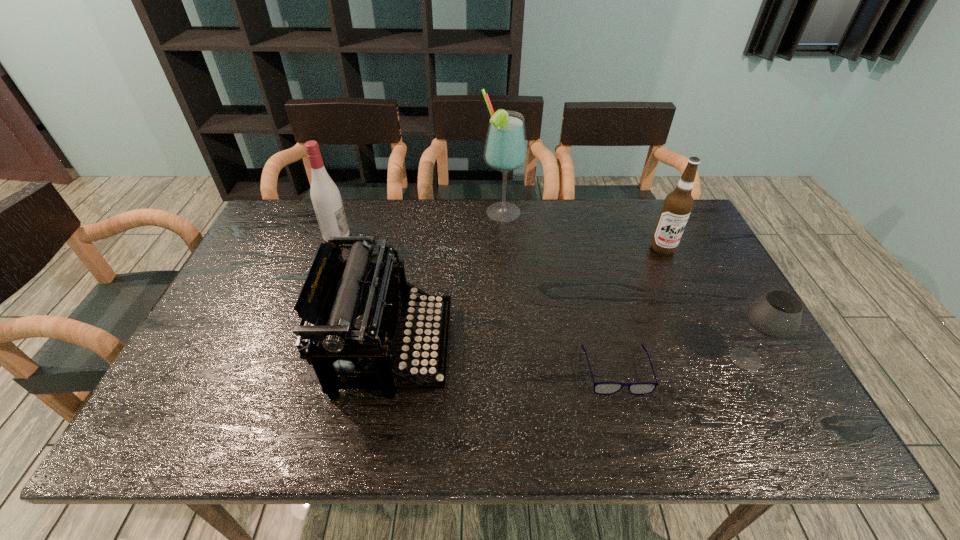
Where is `vacant space at the near edge of the desktop`? vacant space at the near edge of the desktop is located at coordinates (468, 424).

Where is `vacant space at the left edge of the desktop`? vacant space at the left edge of the desktop is located at coordinates (259, 260).

This screenshot has height=540, width=960. I want to click on vacant space at the right edge of the desktop, so click(x=679, y=260).

Where is `free space at the near right corner of the desktop`? This screenshot has width=960, height=540. free space at the near right corner of the desktop is located at coordinates (807, 434).

Identify the location of free point between the wineglass and the second alcohol from left to right. (624, 286).

Where is `vacant space in between the leftmost object and the second alcohol from left to right`? This screenshot has width=960, height=540. vacant space in between the leftmost object and the second alcohol from left to right is located at coordinates (420, 224).

This screenshot has width=960, height=540. What are the coordinates of `vacant area between the shortest object and the wineglass` in the screenshot? It's located at (681, 364).

At what (x,y) coordinates should I click in order to perform the action: click on free space between the farthest alcohol and the second object from left to right. Please return your answer as a coordinate pair (x, y). The width and height of the screenshot is (960, 540). Looking at the image, I should click on (447, 280).

Image resolution: width=960 pixels, height=540 pixels. I want to click on free space that is in between the fourth object from right to left and the leftmost alcohol, so click(420, 224).

Where is `free space between the fifth object from right to left and the wineglass`? This screenshot has width=960, height=540. free space between the fifth object from right to left and the wineglass is located at coordinates (568, 353).